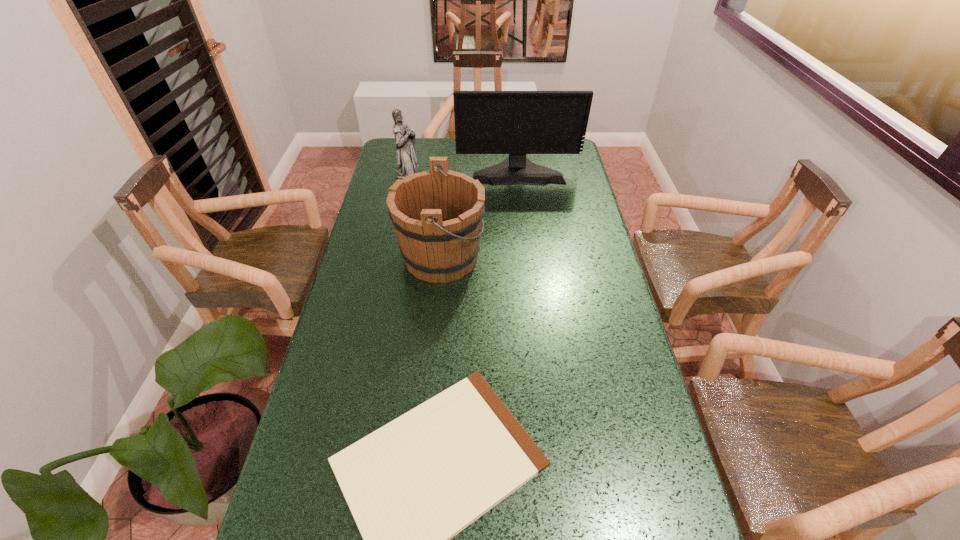
This screenshot has width=960, height=540. In order to click on monitor in this screenshot , I will do `click(517, 123)`.

The width and height of the screenshot is (960, 540). I want to click on the second nearest object, so click(x=437, y=215).

You are a GUI agent. You are given a task and a screenshot of the screen. Output one action in this format:
    pyautogui.click(x=<x>, y=<y>)
    Task: Click on the figurine
    The image size is (960, 540).
    Given the screenshot: What is the action you would take?
    407,164

I want to click on free space located on the screen side of the tallest object, so point(524,228).

Image resolution: width=960 pixels, height=540 pixels. Find the location of `vacant space located 0.240m on the side of the second nearest object with the handle for carrying`. vacant space located 0.240m on the side of the second nearest object with the handle for carrying is located at coordinates (556, 256).

At what (x,y) coordinates should I click in order to perform the action: click on vacant space situated on the front-facing side of the figurine. Please return your answer as a coordinate pair (x, y). Looking at the image, I should click on (472, 173).

You are a GUI agent. You are given a task and a screenshot of the screen. Output one action in this format:
    pyautogui.click(x=<x>, y=<y>)
    Task: Click on the monitor located in the far edge section of the desktop
    This screenshot has height=540, width=960.
    Given the screenshot: What is the action you would take?
    pyautogui.click(x=517, y=123)

What are the coordinates of `figurine at the far edge` in the screenshot? It's located at (407, 164).

This screenshot has height=540, width=960. Identify the location of wine bucket positioned at the left edge. (437, 215).

You are a GUI agent. You are given a task and a screenshot of the screen. Output one action in this format:
    pyautogui.click(x=<x>, y=<y>)
    Task: Click on the figurine present at the left edge
    Image resolution: width=960 pixels, height=540 pixels.
    Given the screenshot: What is the action you would take?
    pyautogui.click(x=407, y=164)